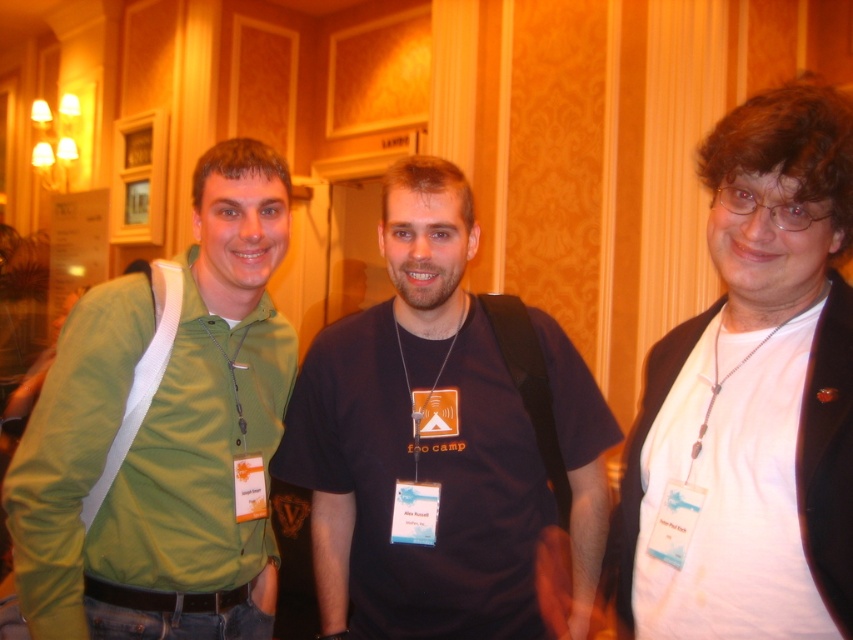
Does dark blue t-shirt at center appear on the right side of green fabric shirt at left?

Indeed, dark blue t-shirt at center is positioned on the right side of green fabric shirt at left.

Is dark blue t-shirt at center bigger than green fabric shirt at left?

Incorrect, dark blue t-shirt at center is not larger than green fabric shirt at left.

Which is behind, point (393, 541) or point (125, 481)?

Positioned behind is point (125, 481).

Identify the location of dark blue t-shirt at center. Image resolution: width=853 pixels, height=640 pixels. (418, 442).

Who is positioned more to the left, green fabric shirt at left or white matte shirt at right?

green fabric shirt at left is more to the left.

Is green fabric shirt at left bigger than white matte shirt at right?

Yes, green fabric shirt at left is bigger than white matte shirt at right.

Find the location of a particular element. The image size is (853, 640). green fabric shirt at left is located at coordinates click(x=165, y=435).

Does point (430, 301) come in front of point (773, 545)?

No, it is not.

Is the position of dark blue t-shirt at center more distant than that of white matte shirt at right?

Yes, dark blue t-shirt at center is further from the viewer.

Measure the distance between point (579, 524) and camera.

Point (579, 524) is 1.47 meters from camera.

The width and height of the screenshot is (853, 640). I want to click on dark blue t-shirt at center, so click(418, 442).